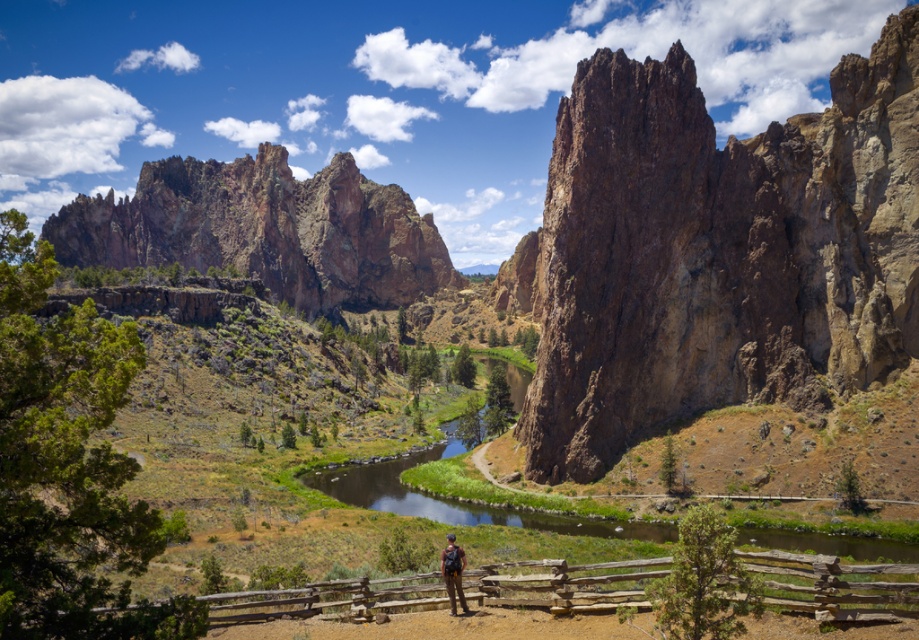
You are a photographer planning to capture the rustic rock formation at upper left and the brown wooden fence at lower center in your shot. Based on their sizes, which object would appear more prominent in the photograph?

The rustic rock formation at upper left would appear more prominent in the photograph because it has a larger size compared to the brown wooden fence at lower center.

You are standing at the fence in the image and want to take a photo of the rustic brown rock at center. Where should you aim your camera relative to the fence?

The rustic brown rock at center is located at the 2D coordinates of point (719, 252). This means it is positioned approximately 39.4 percent from the left edge and 78.3 percent from the top edge of the image. To capture it in your photo, aim your camera such that the rock is centered at this coordinate point relative to the fence.